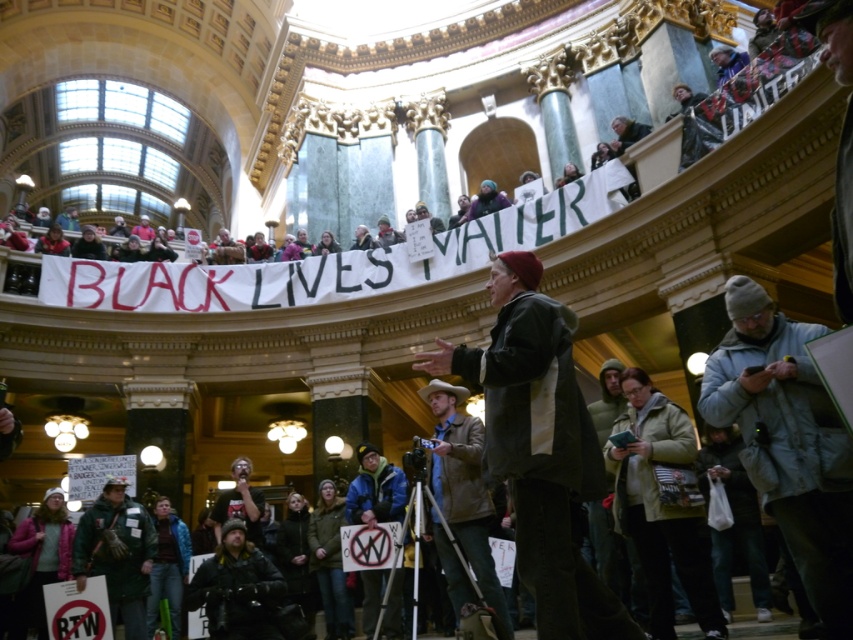
Describe the element at coordinates (538, 448) in the screenshot. I see `dark gray jacket at center` at that location.

Can you confirm if dark gray jacket at center is shorter than gray fleece jacket at lower right?

In fact, dark gray jacket at center may be taller than gray fleece jacket at lower right.

The width and height of the screenshot is (853, 640). Find the location of `dark gray jacket at center`. dark gray jacket at center is located at coordinates (538, 448).

Locate an element on the screen. dark gray jacket at center is located at coordinates (538, 448).

Can you confirm if dark gray jacket at center is shorter than blue jacket at center?

Incorrect, dark gray jacket at center's height does not fall short of blue jacket at center's.

Looking at this image, can you confirm if dark gray jacket at center is thinner than blue jacket at center?

In fact, dark gray jacket at center might be wider than blue jacket at center.

What do you see at coordinates (538, 448) in the screenshot? I see `dark gray jacket at center` at bounding box center [538, 448].

Image resolution: width=853 pixels, height=640 pixels. Identify the location of dark gray jacket at center. (538, 448).

Can you confirm if dark gray jacket at center is wider than dark brown leather jacket at lower center?

Yes.

At what (x,y) coordinates should I click in order to perform the action: click on dark gray jacket at center. Please return your answer as a coordinate pair (x, y). The image size is (853, 640). Looking at the image, I should click on (538, 448).